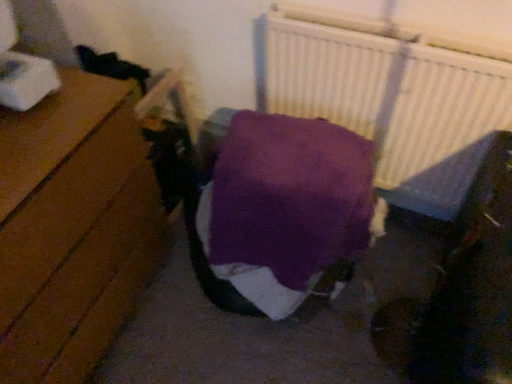
Question: From a real-world perspective, is purple soft blanket at center over wooden floor at left?

Choices:
 (A) no
 (B) yes

Answer: (B)

Question: Is purple soft blanket at center positioned far away from wooden floor at left?

Choices:
 (A) yes
 (B) no

Answer: (B)

Question: Is purple soft blanket at center wider than wooden floor at left?

Choices:
 (A) yes
 (B) no

Answer: (A)

Question: Is purple soft blanket at center outside of wooden floor at left?

Choices:
 (A) no
 (B) yes

Answer: (B)

Question: From a real-world perspective, is purple soft blanket at center under wooden floor at left?

Choices:
 (A) no
 (B) yes

Answer: (A)

Question: Considering the relative positions of purple soft blanket at center and wooden floor at left in the image provided, is purple soft blanket at center to the right of wooden floor at left from the viewer's perspective?

Choices:
 (A) yes
 (B) no

Answer: (A)

Question: Can you confirm if wooden floor at left is thinner than purple soft blanket at center?

Choices:
 (A) yes
 (B) no

Answer: (A)

Question: Can you confirm if wooden floor at left is positioned to the right of purple soft blanket at center?

Choices:
 (A) yes
 (B) no

Answer: (B)

Question: Is wooden floor at left positioned beyond the bounds of purple soft blanket at center?

Choices:
 (A) yes
 (B) no

Answer: (A)

Question: Can you confirm if wooden floor at left is taller than purple soft blanket at center?

Choices:
 (A) yes
 (B) no

Answer: (A)

Question: Is wooden floor at left facing away from purple soft blanket at center?

Choices:
 (A) no
 (B) yes

Answer: (A)

Question: Can you confirm if wooden floor at left is bigger than purple soft blanket at center?

Choices:
 (A) yes
 (B) no

Answer: (A)

Question: From the image's perspective, is purple soft blanket at center over white textured radiator at upper right?

Choices:
 (A) no
 (B) yes

Answer: (A)